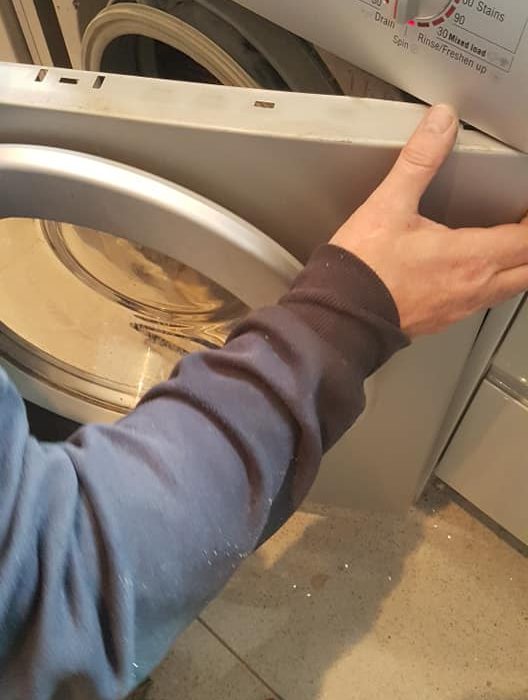
In order to click on washing machine door window in this screenshot , I will do `click(130, 298)`.